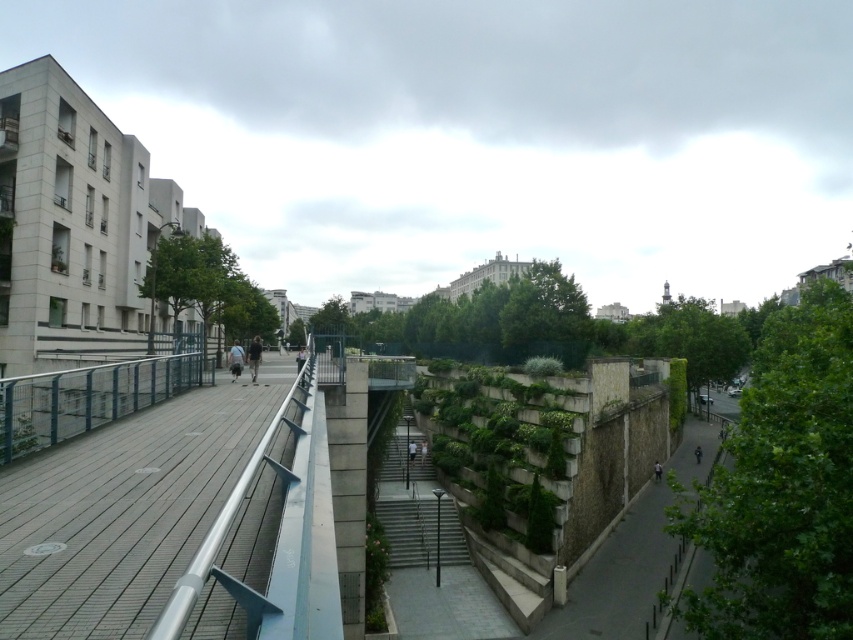
Between metallic blue railing at left and light gray fabric jacket at center, which one has less height?

light gray fabric jacket at center is shorter.

Looking at this image, between metallic blue railing at left and light gray fabric jacket at center, which one appears on the right side from the viewer's perspective?

metallic blue railing at left is more to the right.

Between point (115, 390) and point (236, 349), which one is positioned behind?

The point (236, 349) is behind.

This screenshot has height=640, width=853. Find the location of `metallic blue railing at left`. metallic blue railing at left is located at coordinates [88, 397].

Between point (97, 467) and point (229, 364), which one is positioned in front?

Point (97, 467)

Can you confirm if silver metallic railing at left is bigger than light gray fabric jacket at center?

No, silver metallic railing at left is not bigger than light gray fabric jacket at center.

Locate an element on the screen. silver metallic railing at left is located at coordinates (123, 509).

Where is `silver metallic railing at left`? This screenshot has height=640, width=853. silver metallic railing at left is located at coordinates (123, 509).

You are a GUI agent. You are given a task and a screenshot of the screen. Output one action in this format:
    pyautogui.click(x=<x>, y=<y>)
    Task: Click on the silver metallic railing at left
    This screenshot has width=853, height=640.
    Given the screenshot: What is the action you would take?
    pyautogui.click(x=123, y=509)

Can you confirm if silver metallic railing at left is positioned to the right of metallic blue railing at left?

Indeed, silver metallic railing at left is positioned on the right side of metallic blue railing at left.

Where is `silver metallic railing at left`? silver metallic railing at left is located at coordinates (123, 509).